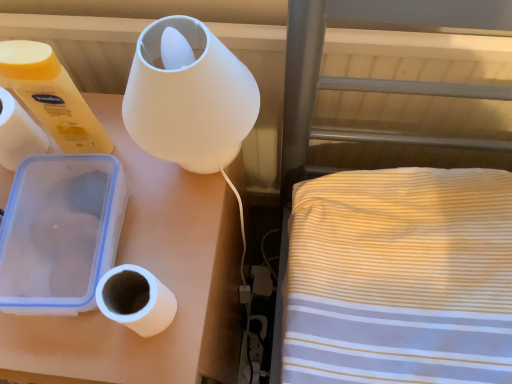
Find the location of a particular element. The width and height of the screenshot is (512, 384). free spot behind white matte toilet paper at lower left, positioned as the first toilet paper in right-to-left order is located at coordinates (169, 225).